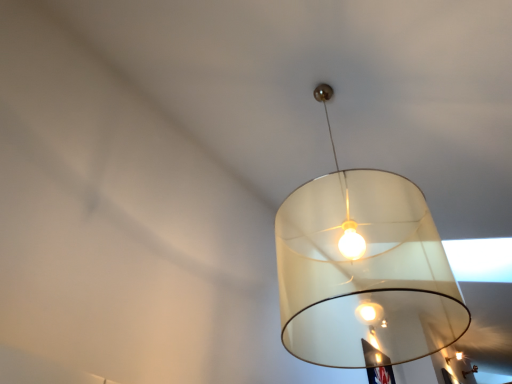
Question: From the image's perspective, is matte white lampshade at center, marked as the 2th lamp in a front-to-back arrangement, on top of translucent white lampshade at upper center, which ranks as the third lamp in right-to-left order?

Choices:
 (A) no
 (B) yes

Answer: (A)

Question: Is matte white lampshade at center, acting as the 2th lamp starting from the top, wider than translucent white lampshade at upper center, which appears as the 1th lamp when viewed from the front?

Choices:
 (A) no
 (B) yes

Answer: (A)

Question: Is translucent white lampshade at upper center, which ranks as the third lamp in back-to-front order, a part of matte white lampshade at center, placed as the second lamp when sorted from back to front?

Choices:
 (A) no
 (B) yes

Answer: (A)

Question: Does matte white lampshade at center, the second lamp ordered from the bottom, lie in front of translucent white lampshade at upper center, which ranks as the third lamp in right-to-left order?

Choices:
 (A) yes
 (B) no

Answer: (B)

Question: Is matte white lampshade at center, the second lamp when ordered from right to left, smaller than translucent white lampshade at upper center, which ranks as the third lamp in right-to-left order?

Choices:
 (A) yes
 (B) no

Answer: (A)

Question: Are matte white lampshade at center, the second lamp when ordered from right to left, and translucent white lampshade at upper center, which ranks as the third lamp in right-to-left order, located far from each other?

Choices:
 (A) yes
 (B) no

Answer: (B)

Question: From a real-world perspective, is translucent white lampshade at upper center, arranged as the 3th lamp when ordered from the bottom, on top of matte white lampshade at center, acting as the 2th lamp starting from the top?

Choices:
 (A) no
 (B) yes

Answer: (A)

Question: From a real-world perspective, is translucent white lampshade at upper center, which appears as the 1th lamp when viewed from the front, under matte white lampshade at center, the second lamp when ordered from right to left?

Choices:
 (A) yes
 (B) no

Answer: (A)

Question: Considering the relative sizes of translucent white lampshade at upper center, marked as the 1th lamp in a left-to-right arrangement, and matte white lampshade at center, the second lamp ordered from the bottom, in the image provided, is translucent white lampshade at upper center, marked as the 1th lamp in a left-to-right arrangement, smaller than matte white lampshade at center, the second lamp ordered from the bottom,?

Choices:
 (A) yes
 (B) no

Answer: (B)

Question: Could matte white lampshade at center, which is the second lamp in left-to-right order, be considered to be inside translucent white lampshade at upper center, which ranks as the third lamp in back-to-front order?

Choices:
 (A) yes
 (B) no

Answer: (B)

Question: Is translucent white lampshade at upper center, arranged as the 3th lamp when ordered from the bottom, at the right side of matte white lampshade at center, placed as the second lamp when sorted from back to front?

Choices:
 (A) no
 (B) yes

Answer: (A)

Question: Is translucent white lampshade at upper center, which ranks as the third lamp in right-to-left order, shorter than matte white lampshade at center, which is the second lamp in left-to-right order?

Choices:
 (A) yes
 (B) no

Answer: (B)

Question: Is the depth of matte white lampshade at center, marked as the 2th lamp in a front-to-back arrangement, greater than that of matte white lampshade at center, the first lamp positioned from the bottom?

Choices:
 (A) yes
 (B) no

Answer: (B)